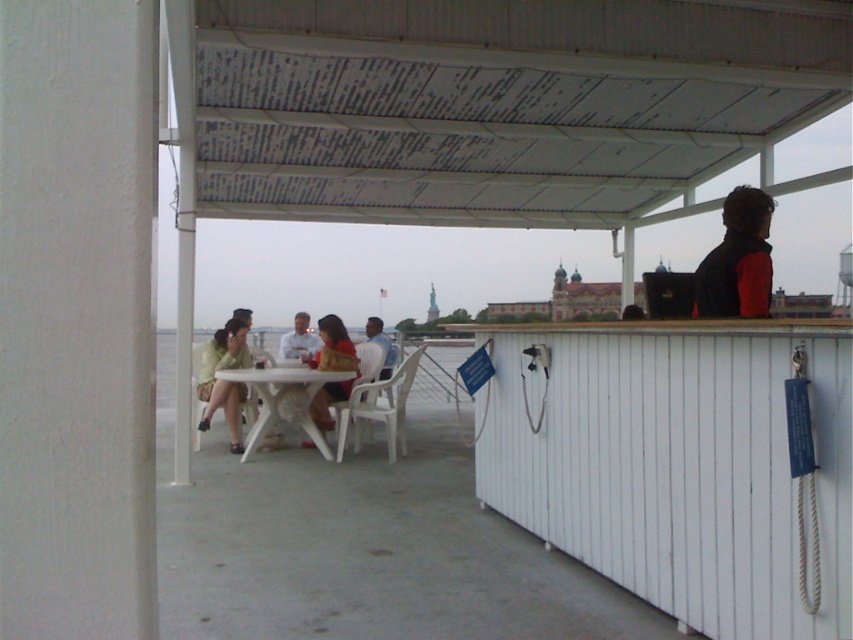
Based on the photo, you are a photographer taking a photo of the two people at the table. You want to ensure both the red fleece jacket at right and the matte yellow shirt at center are clearly visible in the frame. Based on their positions, which direction should you position the camera relative to the table?

Since the red fleece jacket at right is to the right of the matte yellow shirt at center, you should position the camera to the left side of the table to ensure both are visible in the frame.

You are a photographer trying to capture a clear shot of the matte white shirt at center without the red fleece jacket at right blocking it. Can you adjust your position to achieve this?

The red fleece jacket at right is positioned over matte white shirt at center, so moving to the left side would allow you to capture the matte white shirt at center without obstruction from the red fleece jacket at right.